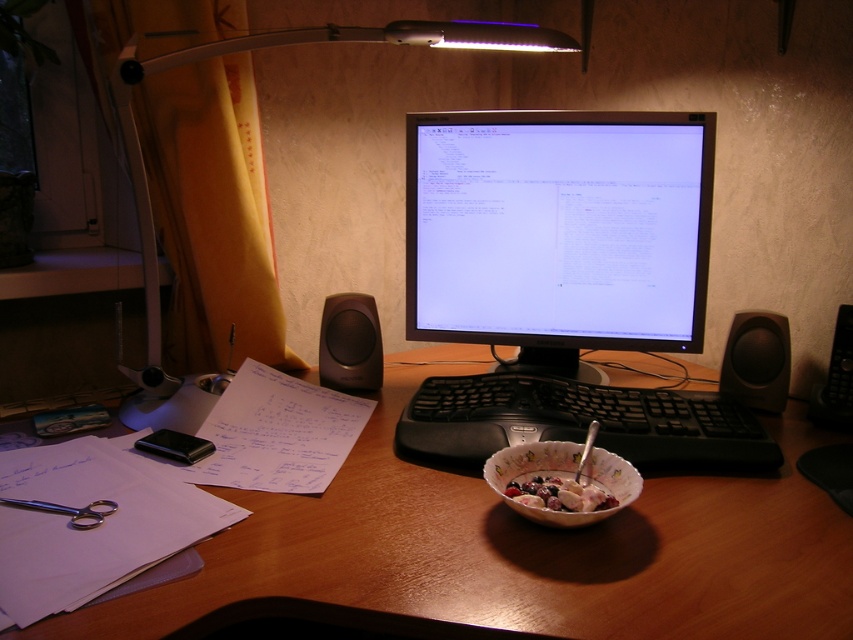
Is matte black monitor at center closer to camera compared to porcelain bowl at center?

No, matte black monitor at center is behind porcelain bowl at center.

Is point (497, 316) farther from viewer compared to point (502, 492)?

Yes, point (497, 316) is behind point (502, 492).

Where is `matte black monitor at center`? This screenshot has height=640, width=853. matte black monitor at center is located at coordinates (558, 228).

Identify the location of wooden at center. The image size is (853, 640). (509, 552).

Is wooden at center to the right of matte black monitor at center from the viewer's perspective?

In fact, wooden at center is to the left of matte black monitor at center.

Between point (341, 506) and point (532, 134), which one is positioned in front?

Point (341, 506)

Find the location of a particular element. This screenshot has width=853, height=640. wooden at center is located at coordinates (509, 552).

Who is lower down, black plastic speaker at right or matte black speaker at lower left?

Positioned lower is black plastic speaker at right.

Can you confirm if black plastic speaker at right is positioned to the right of matte black speaker at lower left?

Indeed, black plastic speaker at right is positioned on the right side of matte black speaker at lower left.

Is point (778, 333) less distant than point (373, 339)?

Yes, point (778, 333) is closer to viewer.

The image size is (853, 640). What are the coordinates of `black plastic speaker at right` in the screenshot? It's located at (757, 360).